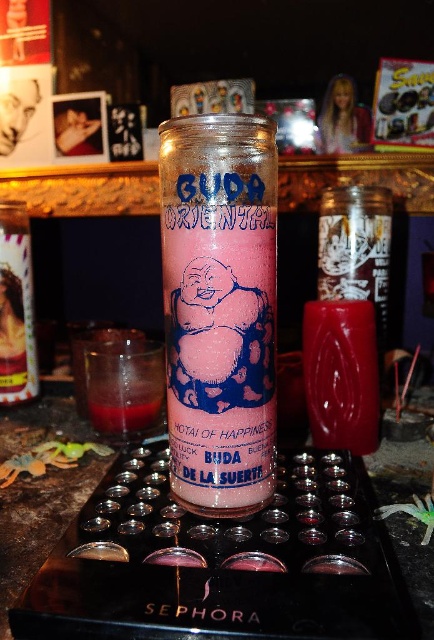
You are standing in front of the candles on the dark surface. You see the point labeled as point (197, 419) and the point labeled as point (416, 484). Which point is closer to you?

Point (197, 419) is closer to you because it is in front of point (416, 484).

Looking at this image, you are arranging items on a table and need to place the pink glitter candle at center and the translucent glass tray at center. According to the image, which item is positioned higher?

The pink glitter candle at center is above the translucent glass tray at center, so it is positioned higher.

You are placing a decorative item on a table and want to ensure it doesn not block the pink glitter candle at center. Where should you place the item to keep it visible?

To ensure the pink glitter candle at center remains visible, place the decorative item away from its position at point (220, 307).